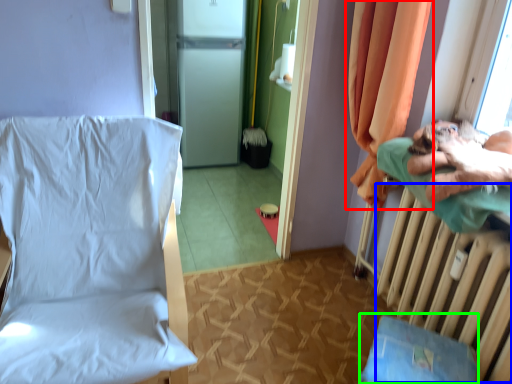
Question: Considering the real-world distances, which object is farthest from curtain (highlighted by a red box)? radiator (highlighted by a blue box) or changing table (highlighted by a green box)?

Choices:
 (A) radiator
 (B) changing table

Answer: (B)